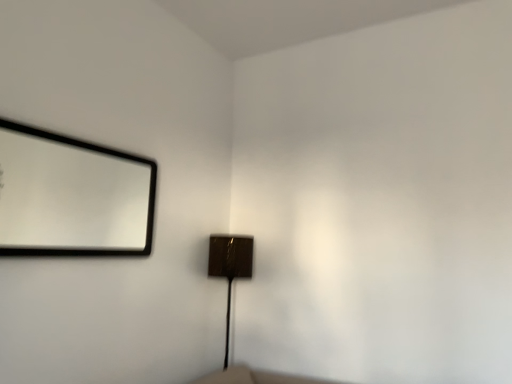
Question: Is shiny brown lamp at center inside matte black mirror at upper left?

Choices:
 (A) no
 (B) yes

Answer: (A)

Question: From a real-world perspective, does matte black mirror at upper left sit lower than shiny brown lamp at center?

Choices:
 (A) no
 (B) yes

Answer: (A)

Question: Considering the relative positions of matte black mirror at upper left and shiny brown lamp at center in the image provided, is matte black mirror at upper left to the left of shiny brown lamp at center from the viewer's perspective?

Choices:
 (A) yes
 (B) no

Answer: (A)

Question: Can we say matte black mirror at upper left lies outside shiny brown lamp at center?

Choices:
 (A) yes
 (B) no

Answer: (A)

Question: Is matte black mirror at upper left turned away from shiny brown lamp at center?

Choices:
 (A) no
 (B) yes

Answer: (A)

Question: Does matte black mirror at upper left have a smaller size compared to shiny brown lamp at center?

Choices:
 (A) no
 (B) yes

Answer: (B)

Question: Could matte black mirror at upper left be considered to be inside shiny brown lamp at center?

Choices:
 (A) yes
 (B) no

Answer: (B)

Question: Does shiny brown lamp at center come behind matte black mirror at upper left?

Choices:
 (A) no
 (B) yes

Answer: (B)

Question: From a real-world perspective, is shiny brown lamp at center beneath matte black mirror at upper left?

Choices:
 (A) no
 (B) yes

Answer: (B)

Question: Does shiny brown lamp at center have a smaller size compared to matte black mirror at upper left?

Choices:
 (A) yes
 (B) no

Answer: (B)

Question: From a real-world perspective, does shiny brown lamp at center stand above matte black mirror at upper left?

Choices:
 (A) yes
 (B) no

Answer: (B)

Question: Does shiny brown lamp at center appear on the left side of matte black mirror at upper left?

Choices:
 (A) yes
 (B) no

Answer: (B)

Question: From their relative heights in the image, would you say shiny brown lamp at center is taller or shorter than matte black mirror at upper left?

Choices:
 (A) tall
 (B) short

Answer: (A)